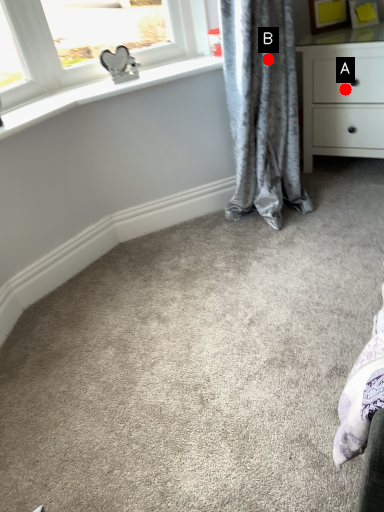
Question: Two points are circled on the image, labeled by A and B beside each circle. Among these points, which one is nearest to the camera?

Choices:
 (A) A is closer
 (B) B is closer

Answer: (B)